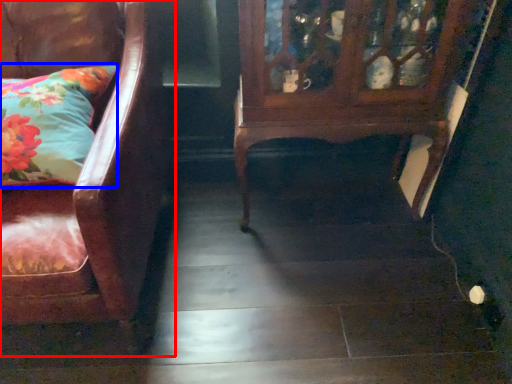
Question: Among these objects, which one is nearest to the camera, chair (highlighted by a red box) or pillow (highlighted by a blue box)?

Choices:
 (A) chair
 (B) pillow

Answer: (A)